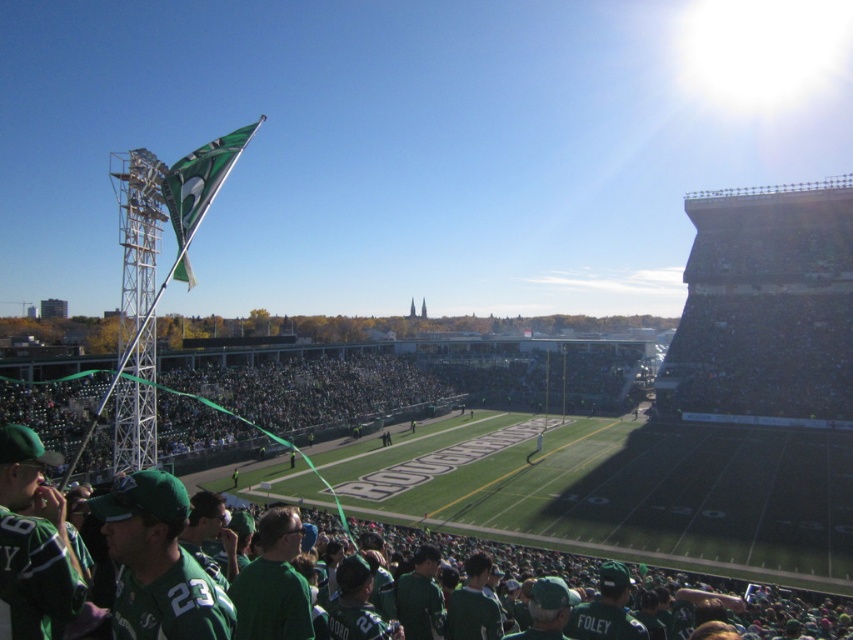
You are a photographer standing at the center of the field. You want to capture a photo that includes both the green matte jersey at lower left and the green fabric flag at upper left. Which object will appear wider in the photo?

The green fabric flag at upper left will appear wider in the photo since its width is greater than the green matte jersey at lower left.

You are a photographer standing at the center of the football stadium. You want to take a photo of the point at coordinates (177, 602). If your camera has a maximum focus range of 30 meters, will it be able to focus on that point?

The point at coordinates (177, 602) is 29.17 meters from the camera, which is within the maximum focus range of 30 meters. Therefore, the camera can focus on that point.

You are a photographer at the stadium and want to capture both the green matte jersey at lower left and the green fabric flag at upper left in a single frame. Which object should you zoom in on to ensure both are visible without cropping?

The green matte jersey at lower left is smaller than the green fabric flag at upper left, so you should zoom in on the green fabric flag at upper left to ensure both are visible without cropping.